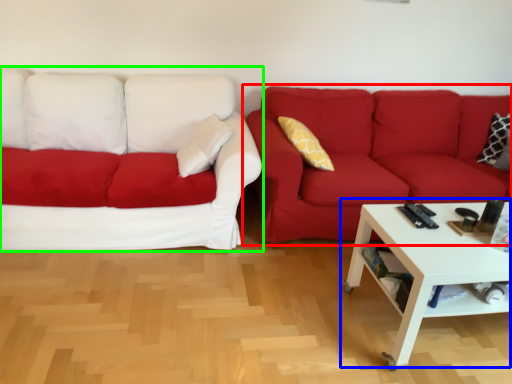
Question: Considering the real-world distances, which object is farthest from studio couch (highlighted by a red box)? coffee table (highlighted by a blue box) or studio couch (highlighted by a green box)?

Choices:
 (A) coffee table
 (B) studio couch

Answer: (B)